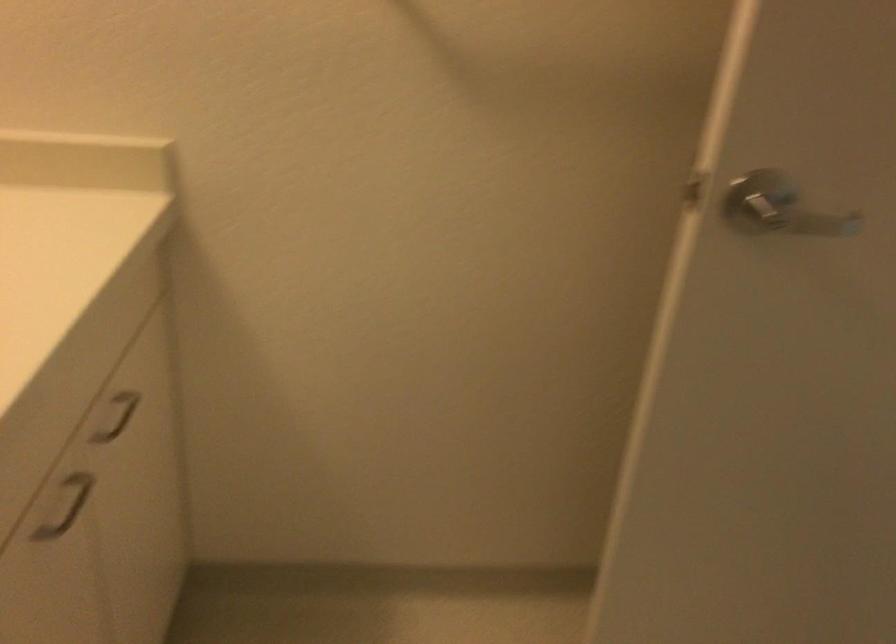
Locate an element on the screen. The image size is (896, 644). silver door handle is located at coordinates (780, 207).